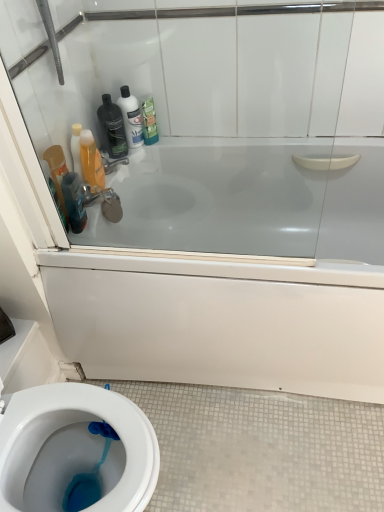
Where is `vacant area to the right of green matte bottle at upper center, arranged as the 3th cleaning product when viewed from the left`? vacant area to the right of green matte bottle at upper center, arranged as the 3th cleaning product when viewed from the left is located at coordinates (188, 141).